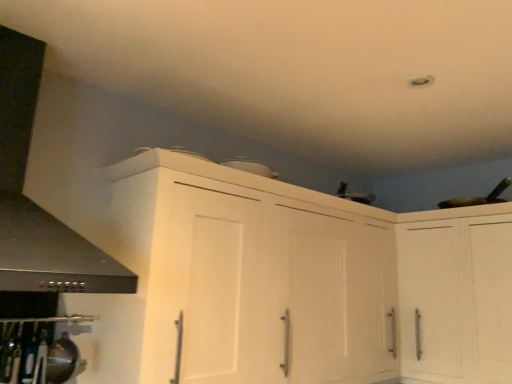
At what (x,y) coordinates should I click in order to perform the action: click on black matte exhaust hood at left. Please return your answer as a coordinate pair (x, y). Image resolution: width=512 pixels, height=384 pixels. Looking at the image, I should click on (33, 202).

I want to click on white matte cabinet at upper center, the first cabinetry in the left-to-right sequence, so (x=296, y=283).

Considering the sizes of objects black matte exhaust hood at left and white matte cabinet at upper center, the first cabinetry in the left-to-right sequence, in the image provided, who is bigger, black matte exhaust hood at left or white matte cabinet at upper center, the first cabinetry in the left-to-right sequence,?

With larger size is white matte cabinet at upper center, the first cabinetry in the left-to-right sequence.

The image size is (512, 384). What are the coordinates of `exhaust hood located on the left of white matte cabinet at upper center, the first cabinetry in the left-to-right sequence` in the screenshot? It's located at (33, 202).

Does black matte exhaust hood at left turn towards white matte cabinet at upper center, the first cabinetry in the left-to-right sequence?

No, black matte exhaust hood at left is not facing towards white matte cabinet at upper center, the first cabinetry in the left-to-right sequence.

Is black matte exhaust hood at left positioned far away from white matte cabinet at upper center, which ranks as the 2th cabinetry in right-to-left order?

No, black matte exhaust hood at left is not far from white matte cabinet at upper center, which ranks as the 2th cabinetry in right-to-left order.

Who is smaller, white matte cabinet at upper right, which ranks as the second cabinetry in left-to-right order, or black matte exhaust hood at left?

With smaller size is black matte exhaust hood at left.

Consider the image. Is white matte cabinet at upper right, the 1th cabinetry positioned from the right, far from black matte exhaust hood at left?

Yes, white matte cabinet at upper right, the 1th cabinetry positioned from the right, is far from black matte exhaust hood at left.

Is white matte cabinet at upper right, which ranks as the second cabinetry in left-to-right order, facing towards black matte exhaust hood at left?

Yes, white matte cabinet at upper right, which ranks as the second cabinetry in left-to-right order, faces towards black matte exhaust hood at left.

Based on their positions, is black matte exhaust hood at left located to the left or right of white matte cabinet at upper right, the 1th cabinetry positioned from the right?

Clearly, black matte exhaust hood at left is on the left of white matte cabinet at upper right, the 1th cabinetry positioned from the right, in the image.

Consider the image. Which of these two, black matte exhaust hood at left or white matte cabinet at upper right, which ranks as the second cabinetry in left-to-right order, is thinner?

With smaller width is white matte cabinet at upper right, which ranks as the second cabinetry in left-to-right order.

Is black matte exhaust hood at left positioned in front of white matte cabinet at upper right, which ranks as the second cabinetry in left-to-right order?

Yes.

From the black matte exhaust hood at left, count 2nd cabinetrys backward and point to it. Please provide its 2D coordinates.

[(456, 294)]

Is white matte cabinet at upper center, which ranks as the 2th cabinetry in right-to-left order, located outside black matte exhaust hood at left?

white matte cabinet at upper center, which ranks as the 2th cabinetry in right-to-left order, is positioned outside black matte exhaust hood at left.

Is white matte cabinet at upper center, the first cabinetry in the left-to-right sequence, next to black matte exhaust hood at left and touching it?

No, white matte cabinet at upper center, the first cabinetry in the left-to-right sequence, is not touching black matte exhaust hood at left.

From the image's perspective, is white matte cabinet at upper center, which ranks as the 2th cabinetry in right-to-left order, above black matte exhaust hood at left?

No, from the image's perspective, white matte cabinet at upper center, which ranks as the 2th cabinetry in right-to-left order, is not over black matte exhaust hood at left.

Consider the image. Is white matte cabinet at upper center, the first cabinetry in the left-to-right sequence, oriented away from black matte exhaust hood at left?

No, white matte cabinet at upper center, the first cabinetry in the left-to-right sequence, is not facing the opposite direction of black matte exhaust hood at left.

Does point (159, 266) appear closer or farther from the camera than point (476, 247)?

Point (159, 266) is positioned closer to the camera compared to point (476, 247).

Looking at the image, does white matte cabinet at upper center, the first cabinetry in the left-to-right sequence, seem bigger or smaller compared to white matte cabinet at upper right, which ranks as the second cabinetry in left-to-right order?

In the image, white matte cabinet at upper center, the first cabinetry in the left-to-right sequence, appears to be larger than white matte cabinet at upper right, which ranks as the second cabinetry in left-to-right order.

Is white matte cabinet at upper right, the 1th cabinetry positioned from the right, located within white matte cabinet at upper center, the first cabinetry in the left-to-right sequence?

No, white matte cabinet at upper right, the 1th cabinetry positioned from the right, is not a part of white matte cabinet at upper center, the first cabinetry in the left-to-right sequence.

From a real-world perspective, is white matte cabinet at upper center, which ranks as the 2th cabinetry in right-to-left order, physically located above or below white matte cabinet at upper right, which ranks as the second cabinetry in left-to-right order?

white matte cabinet at upper center, which ranks as the 2th cabinetry in right-to-left order, is situated higher than white matte cabinet at upper right, which ranks as the second cabinetry in left-to-right order, in the real world.

Does white matte cabinet at upper right, which ranks as the second cabinetry in left-to-right order, appear on the left side of white matte cabinet at upper center, which ranks as the 2th cabinetry in right-to-left order?

Incorrect, white matte cabinet at upper right, which ranks as the second cabinetry in left-to-right order, is not on the left side of white matte cabinet at upper center, which ranks as the 2th cabinetry in right-to-left order.

Is white matte cabinet at upper right, which ranks as the second cabinetry in left-to-right order, positioned with its back to white matte cabinet at upper center, the first cabinetry in the left-to-right sequence?

No, white matte cabinet at upper right, which ranks as the second cabinetry in left-to-right order,'s orientation is not away from white matte cabinet at upper center, the first cabinetry in the left-to-right sequence.

Would you say white matte cabinet at upper right, which ranks as the second cabinetry in left-to-right order, is a long distance from white matte cabinet at upper center, which ranks as the 2th cabinetry in right-to-left order?

white matte cabinet at upper right, which ranks as the second cabinetry in left-to-right order, is near white matte cabinet at upper center, which ranks as the 2th cabinetry in right-to-left order, not far away.

How many degrees apart are the facing directions of white matte cabinet at upper right, the 1th cabinetry positioned from the right, and white matte cabinet at upper center, which ranks as the 2th cabinetry in right-to-left order?

There is a 88.2-degree angle between the facing directions of white matte cabinet at upper right, the 1th cabinetry positioned from the right, and white matte cabinet at upper center, which ranks as the 2th cabinetry in right-to-left order.

Which cabinetry is the 1st one when counting from the back of the black matte exhaust hood at left? Please provide its 2D coordinates.

[(296, 283)]

Find the location of a particular element. The image size is (512, 384). exhaust hood located in front of the white matte cabinet at upper right, which ranks as the second cabinetry in left-to-right order is located at coordinates (33, 202).

Based on their spatial positions, is white matte cabinet at upper center, the first cabinetry in the left-to-right sequence, or white matte cabinet at upper right, which ranks as the second cabinetry in left-to-right order, further from black matte exhaust hood at left?

white matte cabinet at upper right, which ranks as the second cabinetry in left-to-right order, is positioned further to the anchor black matte exhaust hood at left.

Consider the image. Based on their spatial positions, is white matte cabinet at upper right, which ranks as the second cabinetry in left-to-right order, or black matte exhaust hood at left further from white matte cabinet at upper center, which ranks as the 2th cabinetry in right-to-left order?

black matte exhaust hood at left is further to white matte cabinet at upper center, which ranks as the 2th cabinetry in right-to-left order.

From the image, which object appears to be nearer to white matte cabinet at upper right, the 1th cabinetry positioned from the right, black matte exhaust hood at left or white matte cabinet at upper center, the first cabinetry in the left-to-right sequence?

Among the two, white matte cabinet at upper center, the first cabinetry in the left-to-right sequence, is located nearer to white matte cabinet at upper right, the 1th cabinetry positioned from the right.

Estimate the real-world distances between objects in this image. Which object is closer to black matte exhaust hood at left, white matte cabinet at upper right, the 1th cabinetry positioned from the right, or white matte cabinet at upper center, the first cabinetry in the left-to-right sequence?

white matte cabinet at upper center, the first cabinetry in the left-to-right sequence, is positioned closer to the anchor black matte exhaust hood at left.

Based on their spatial positions, is black matte exhaust hood at left or white matte cabinet at upper right, which ranks as the second cabinetry in left-to-right order, further from white matte cabinet at upper center, the first cabinetry in the left-to-right sequence?

black matte exhaust hood at left.

Based on their spatial positions, is white matte cabinet at upper center, the first cabinetry in the left-to-right sequence, or black matte exhaust hood at left closer to white matte cabinet at upper right, which ranks as the second cabinetry in left-to-right order?

The object closer to white matte cabinet at upper right, which ranks as the second cabinetry in left-to-right order, is white matte cabinet at upper center, the first cabinetry in the left-to-right sequence.

You are a GUI agent. You are given a task and a screenshot of the screen. Output one action in this format:
    pyautogui.click(x=<x>, y=<y>)
    Task: Click on the cabinetry between black matte exhaust hood at left and white matte cabinet at upper right, the 1th cabinetry positioned from the right
    Image resolution: width=512 pixels, height=384 pixels.
    Given the screenshot: What is the action you would take?
    pyautogui.click(x=296, y=283)